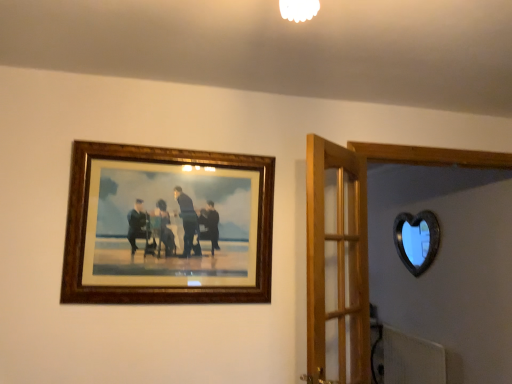
Question: In the image, is wooden frame at upper left on the left side or the right side of wooden door at center?

Choices:
 (A) right
 (B) left

Answer: (B)

Question: Is wooden frame at upper left wider or thinner than wooden door at center?

Choices:
 (A) wide
 (B) thin

Answer: (B)

Question: Which is nearer to the wooden frame at upper left?

Choices:
 (A) wooden door at center
 (B) black glass heart at upper right

Answer: (A)

Question: Which is farther from the wooden frame at upper left?

Choices:
 (A) black glass heart at upper right
 (B) wooden door at center

Answer: (A)